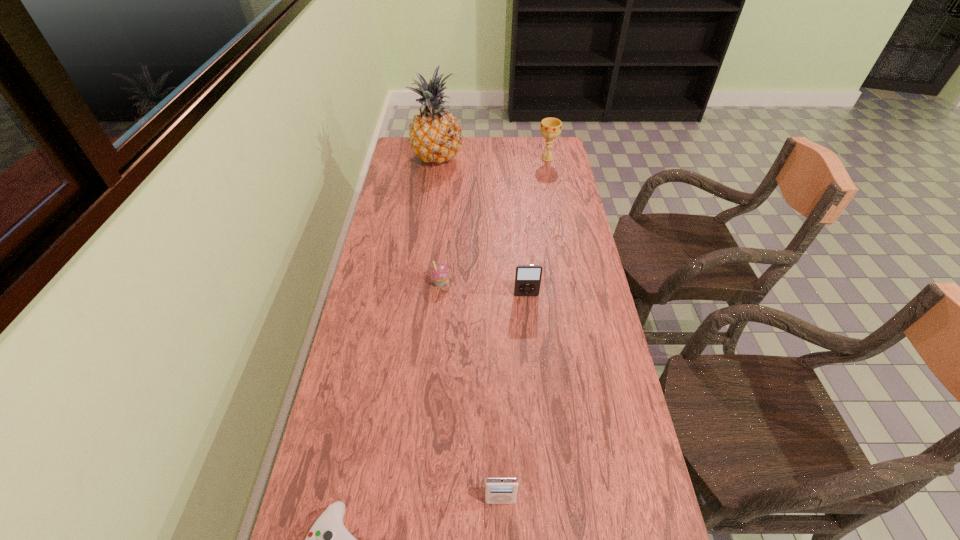
Locate which object is the fifth closest to the third farthest object. Please provide its 2D coordinates. Your answer should be formatted as a tuple, i.e. [(x, y)], where the tuple contains the x and y coordinates of a point satisfying the conditions above.

[(550, 128)]